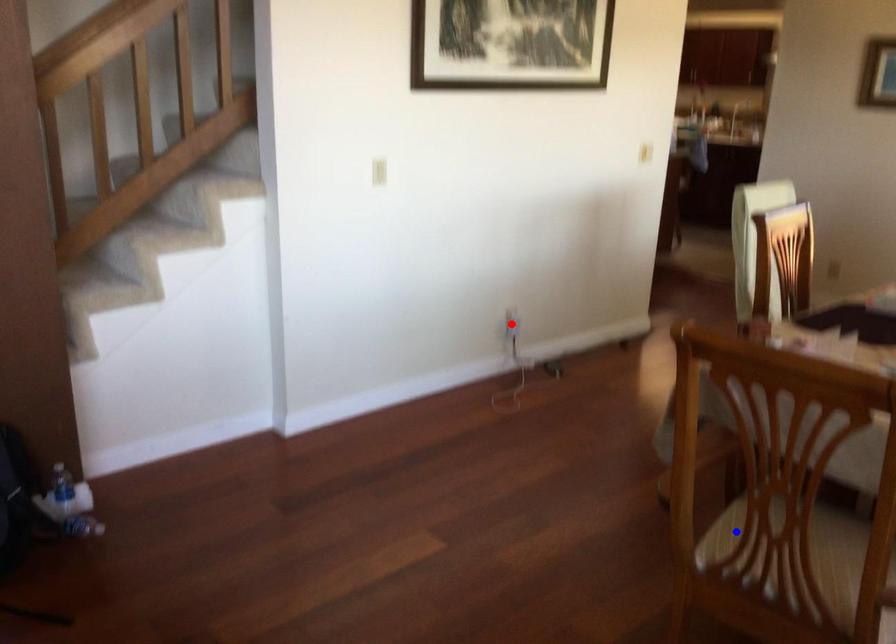
Question: In the image, two points are highlighted. Which point is nearer to the camera? Reply with the corresponding letter.

Choices:
 (A) blue point
 (B) red point

Answer: (A)